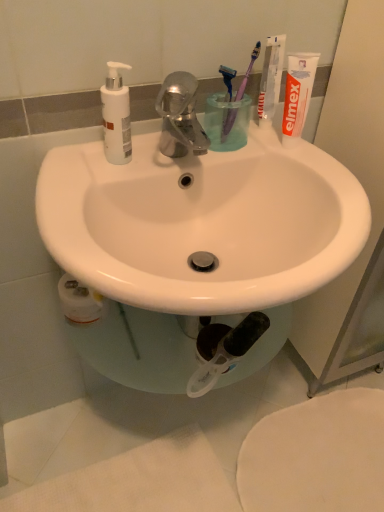
Find the location of a particular element. The width and height of the screenshot is (384, 512). empty space that is ontop of white matte bidet at lower right (from a real-world perspective) is located at coordinates (319, 452).